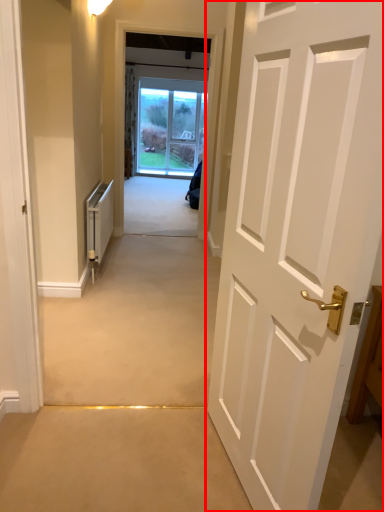
Question: From the image, what is the correct spatial relationship of door (annotated by the red box) in relation to appliance?

Choices:
 (A) right
 (B) left

Answer: (A)